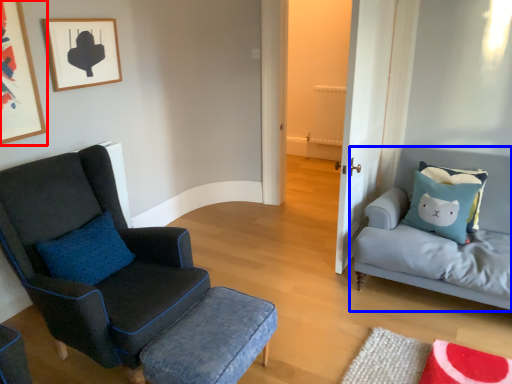
Question: Among these objects, which one is farthest to the camera, picture frame (highlighted by a red box) or studio couch (highlighted by a blue box)?

Choices:
 (A) picture frame
 (B) studio couch

Answer: (B)